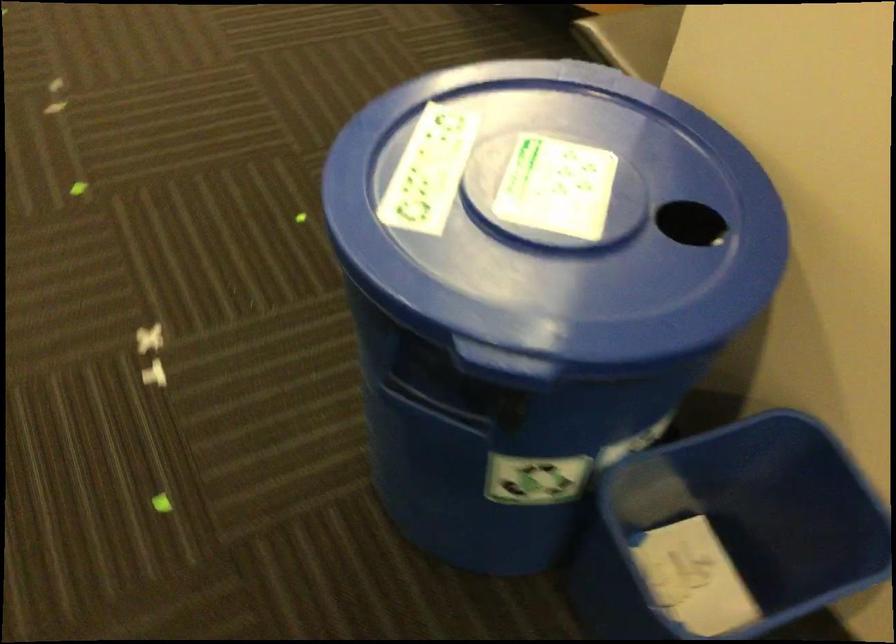
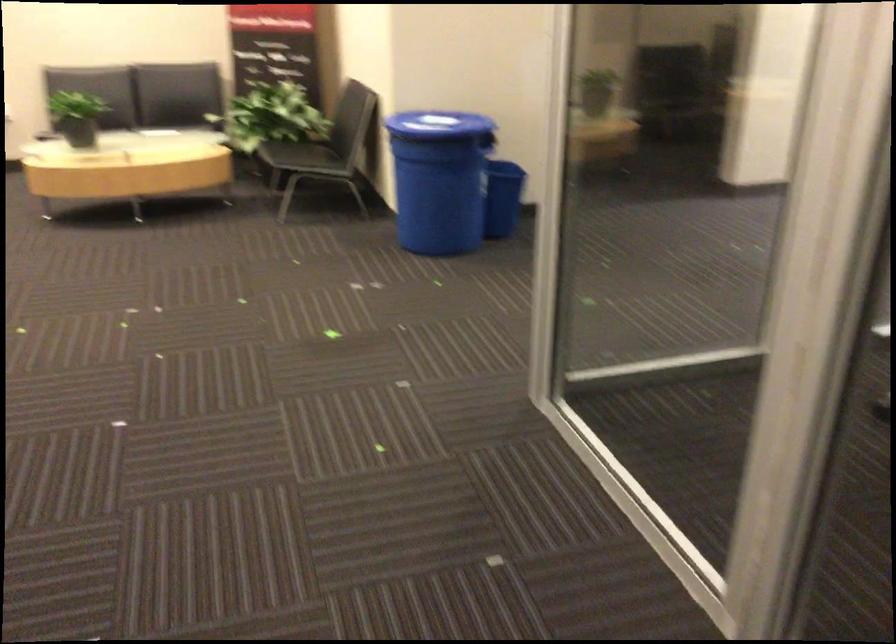
In the second image, find the point that corresponds to (424,236) in the first image.

(438, 124)